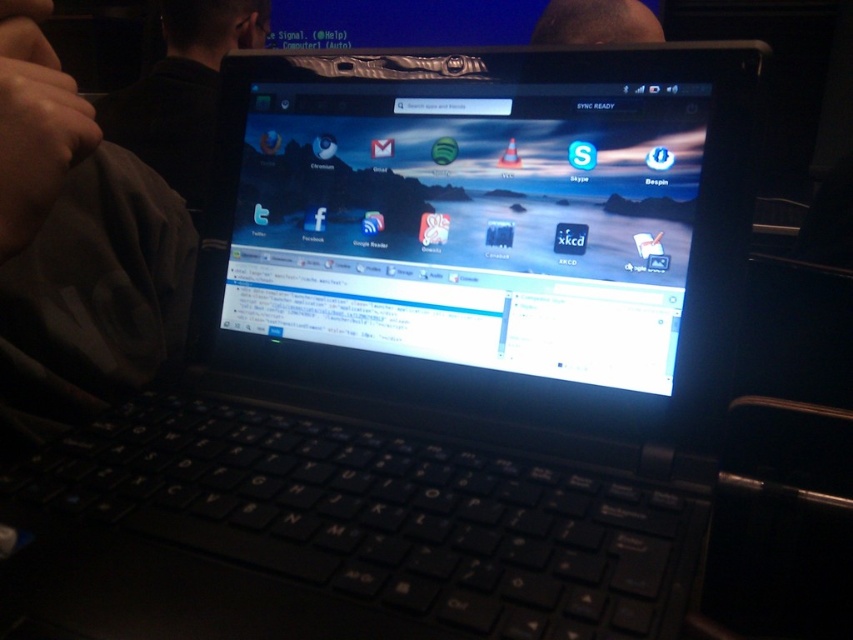
Question: Based on their relative distances, which object is farther from the glossy plastic screen at center?

Choices:
 (A) dark fabric at lower left
 (B) black fabric at upper left

Answer: (B)

Question: Considering the relative positions of glossy plastic screen at center and black fabric at upper left in the image provided, where is glossy plastic screen at center located with respect to black fabric at upper left?

Choices:
 (A) right
 (B) left

Answer: (A)

Question: Which point is closer to the camera?

Choices:
 (A) glossy plastic screen at center
 (B) dark fabric at lower left
 (C) black fabric at upper left

Answer: (B)

Question: Is dark fabric at lower left wider than black fabric at upper left?

Choices:
 (A) no
 (B) yes

Answer: (A)

Question: Which object is positioned farthest from the dark fabric at lower left?

Choices:
 (A) black fabric at upper left
 (B) glossy plastic screen at center

Answer: (A)

Question: Does dark fabric at lower left have a smaller size compared to black fabric at upper left?

Choices:
 (A) yes
 (B) no

Answer: (A)